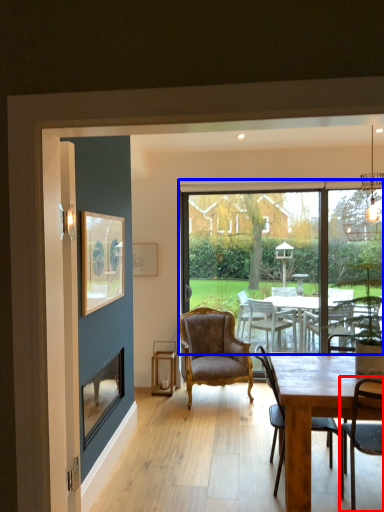
Question: Which object is closer to the camera taking this photo, chair (highlighted by a red box) or window (highlighted by a blue box)?

Choices:
 (A) chair
 (B) window

Answer: (A)